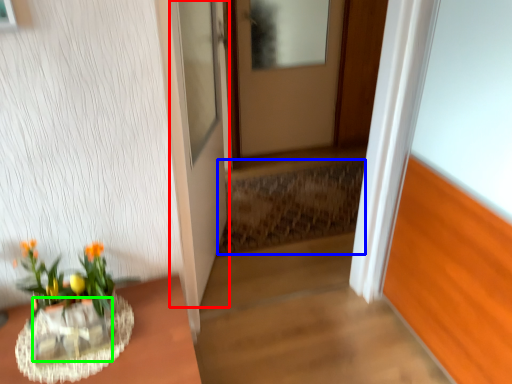
Question: Estimate the real-world distances between objects in this image. Which object is farther from door (highlighted by a red box), stairwell (highlighted by a blue box) or glass vase (highlighted by a green box)?

Choices:
 (A) stairwell
 (B) glass vase

Answer: (B)